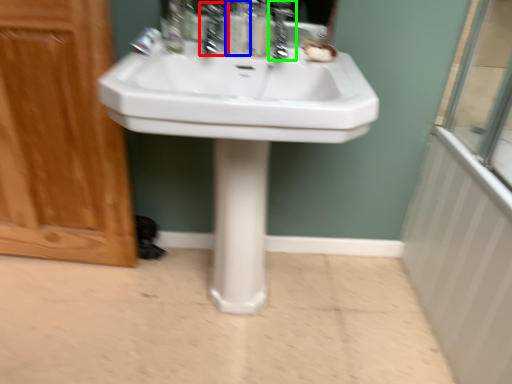
Question: Which is farther away from faucet (highlighted by a red box)? soap dispenser (highlighted by a blue box) or faucet (highlighted by a green box)?

Choices:
 (A) soap dispenser
 (B) faucet

Answer: (B)